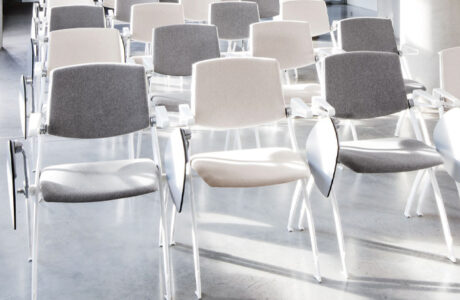
At what (x,y) coordinates should I click in order to perform the action: click on grey coloured chairs. Please return your answer as a coordinate pair (x, y). The image size is (460, 300). Looking at the image, I should click on (105, 120), (177, 50), (236, 12), (267, 5), (77, 18), (122, 6), (375, 41), (356, 72).